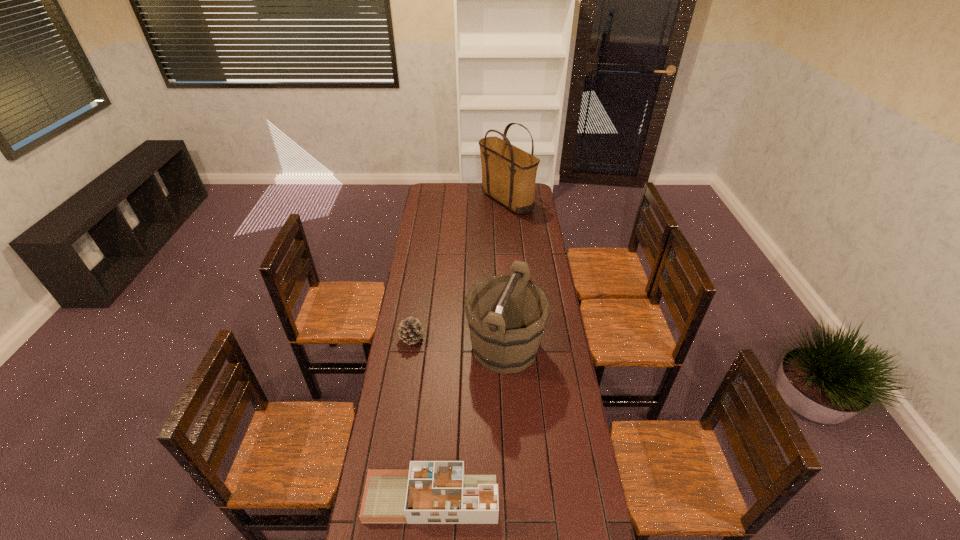
Find the location of a particular element. The width and height of the screenshot is (960, 540). the tallest object is located at coordinates (508, 173).

At what (x,y) coordinates should I click in order to perform the action: click on the farthest object. Please return your answer as a coordinate pair (x, y). Looking at the image, I should click on (508, 173).

The width and height of the screenshot is (960, 540). What are the coordinates of `bucket` in the screenshot? It's located at (506, 318).

At what (x,y) coordinates should I click in order to perform the action: click on pinecone. Please return your answer as a coordinate pair (x, y). This screenshot has height=540, width=960. Looking at the image, I should click on (409, 331).

This screenshot has width=960, height=540. I want to click on the shortest object, so click(x=431, y=492).

This screenshot has height=540, width=960. In order to click on the nearest object in this screenshot , I will do `click(431, 492)`.

In order to click on free space located on the left of the tallest object in this screenshot , I will do `click(433, 200)`.

Locate an element on the screen. vacant space situated 0.140m on the back of the third shortest object is located at coordinates 502,298.

This screenshot has height=540, width=960. Find the location of `free space located on the front of the second shortest object`. free space located on the front of the second shortest object is located at coordinates (398, 426).

The width and height of the screenshot is (960, 540). I want to click on free space located 0.220m at the front door of the nearest object, so click(564, 498).